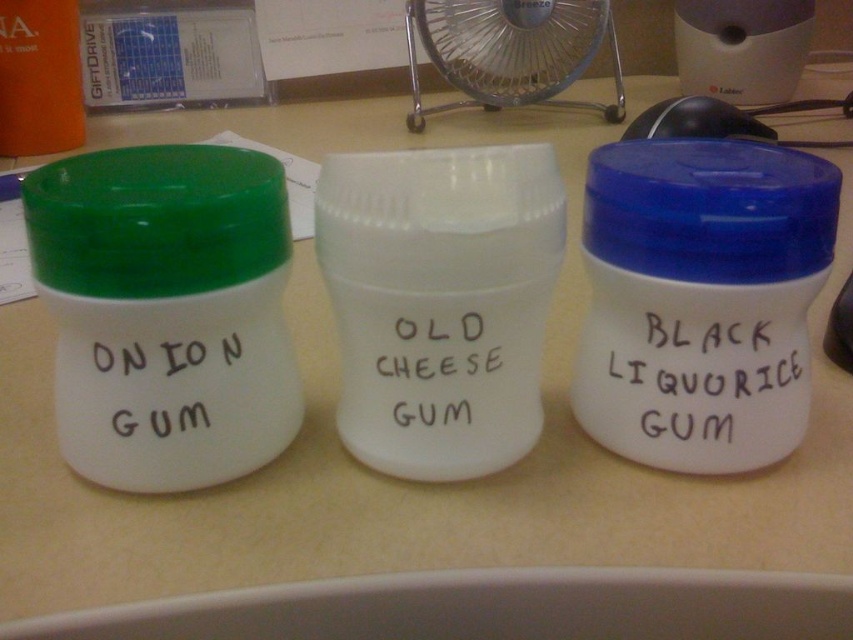
Looking at this image, you are standing in front of the desk with the three gum containers. You want to reach a point that is exactly 20 inches away from you. Can you reach the point at point [576,401]?

The point at point [576,401] is 21.87 inches from the viewer, which is farther than 20 inches. Therefore, you cannot reach it with your hand at that distance.

You are a delivery robot with a 25 cm wide arm. You need to place a new container between the green matte lid at left and the blue plastic lid at center. Can your arm fit through the space between them?

The distance between the green matte lid at left and the blue plastic lid at center is 26.12 centimeters, so the robot arm can fit through the space since it is wider than the arm.

Consider the image. You are standing at the edge of the desk looking towards the containers. You want to move a small object from point A to point B. Point A is at point [822,225] and point B is at point [154,356]. Which direction should you move the object to get from point A to point B?

To move the object from point A at [822,225] to point B at [154,356], you should move it forward because point A is behind point B according to the spatial relationship provided.